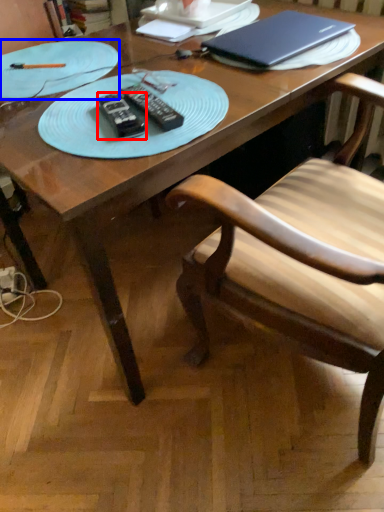
Question: Among these objects, which one is nearest to the camera, remote (highlighted by a red box) or plate (highlighted by a blue box)?

Choices:
 (A) remote
 (B) plate

Answer: (A)